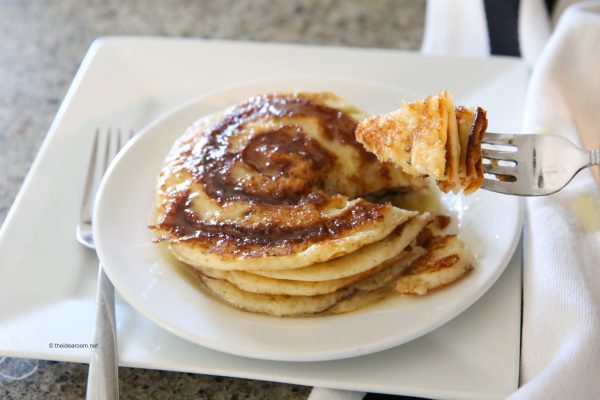
This screenshot has width=600, height=400. In order to click on table in this screenshot , I will do `click(355, 30)`.